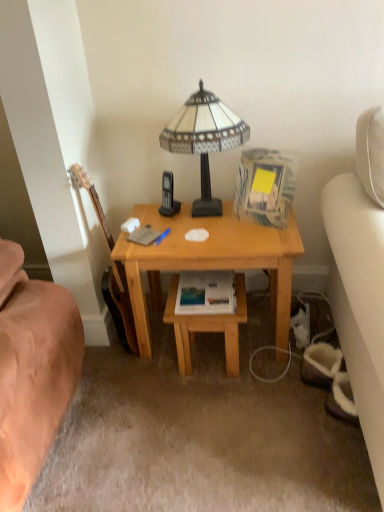
Locate an element on the screen. This screenshot has height=512, width=384. free space in front of stained glass lampshade at center is located at coordinates (211, 240).